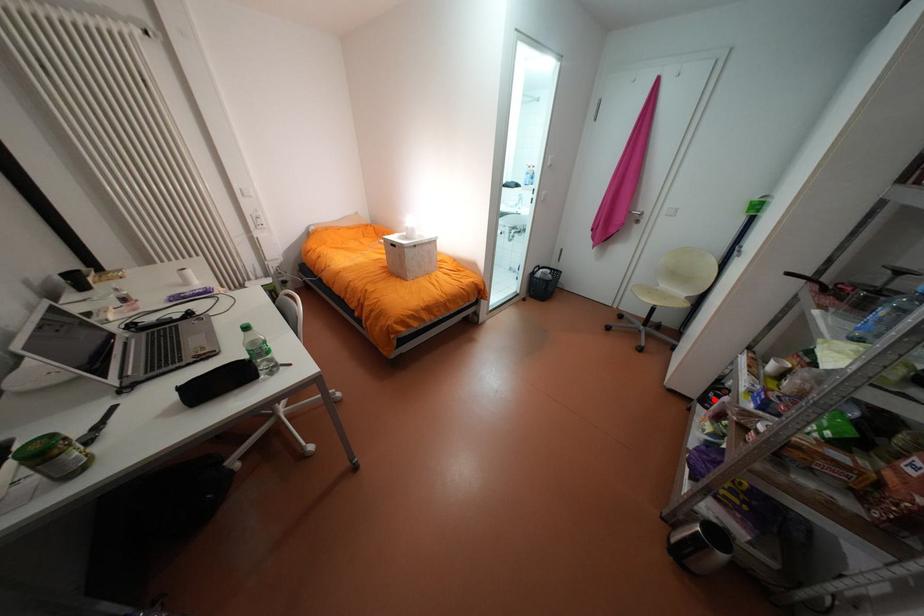
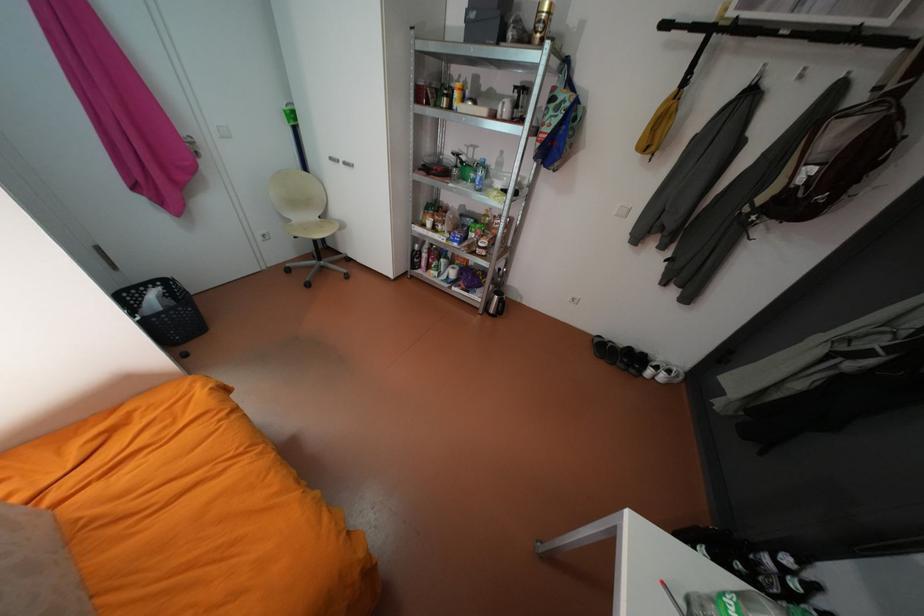
Locate, in the second image, the point that corresponds to the highlighted location in the first image.

(423, 265)